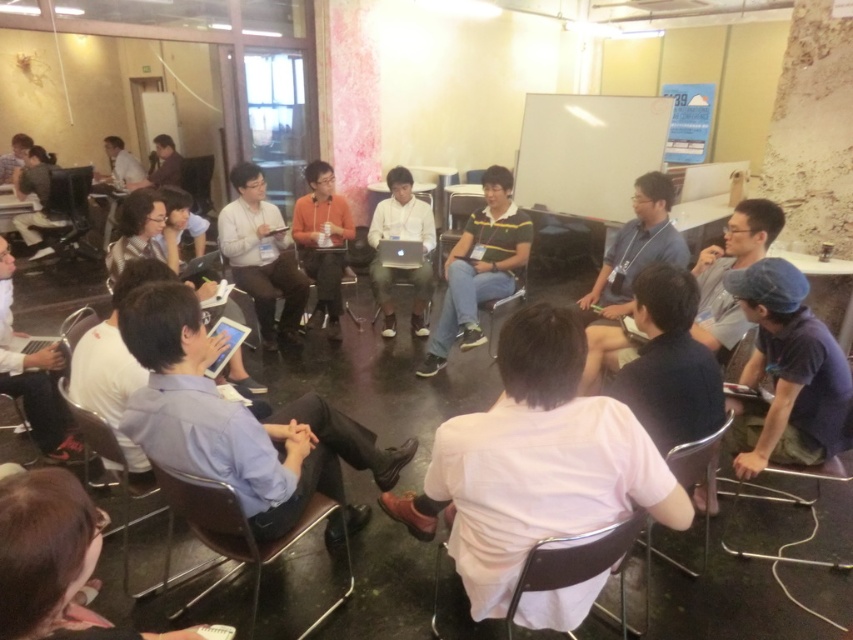
Question: Among these points, which one is farthest from the camera?

Choices:
 (A) (257, 273)
 (B) (495, 493)
 (C) (428, 262)
 (D) (331, 314)

Answer: (D)

Question: Is white matte shirt at center bigger than matte black chair at lower left?

Choices:
 (A) yes
 (B) no

Answer: (A)

Question: Does yellow-green striped shirt at center have a smaller size compared to matte black chair at lower left?

Choices:
 (A) no
 (B) yes

Answer: (A)

Question: Which point is farther from the camera taking this photo?

Choices:
 (A) (68, 321)
 (B) (634, 435)
 (C) (460, 294)
 (D) (508, 618)

Answer: (C)

Question: Does metallic silver chair at lower center come behind matte black chair at lower left?

Choices:
 (A) no
 (B) yes

Answer: (A)

Question: Which of the following is the closest to the observer?

Choices:
 (A) (660, 513)
 (B) (111, 458)
 (C) (341, 301)
 (D) (445, 298)

Answer: (A)